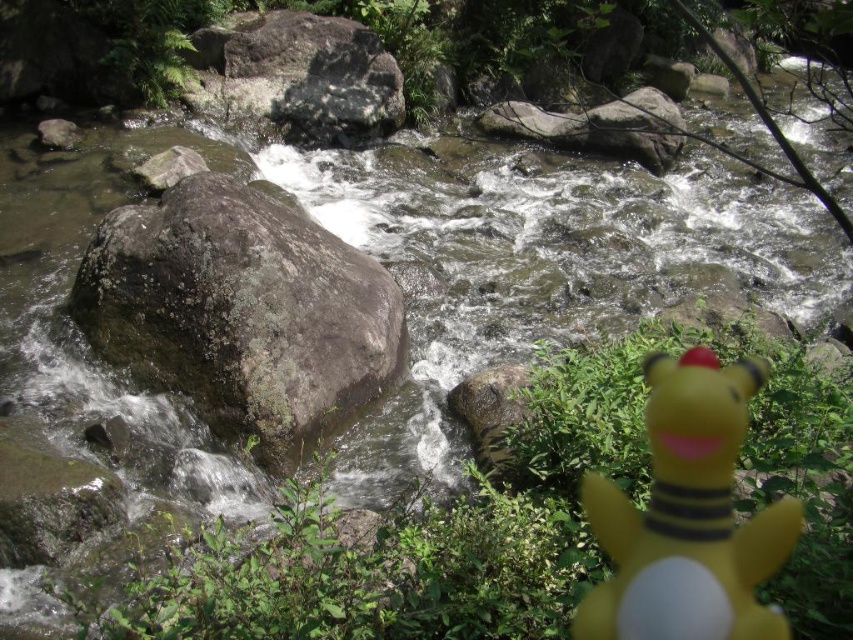
Question: Is yellow rubber duck at lower right bigger than gray rough rock at upper center?

Choices:
 (A) yes
 (B) no

Answer: (B)

Question: Which of these objects is positioned farthest from the green mossy rock at center-left?

Choices:
 (A) gray rough rock at upper center
 (B) yellow rubber duck at lower right

Answer: (A)

Question: Can you confirm if green mossy rock at center-left is positioned to the right of gray rough rock at upper center?

Choices:
 (A) no
 (B) yes

Answer: (B)

Question: Which of the following is the closest to the observer?

Choices:
 (A) (99, 257)
 (B) (635, 598)
 (C) (340, 93)

Answer: (B)

Question: Is green mossy rock at center-left further to the viewer compared to yellow rubber duck at lower right?

Choices:
 (A) no
 (B) yes

Answer: (B)

Question: Which of these objects is positioned farthest from the green mossy rock at center-left?

Choices:
 (A) gray rough rock at upper center
 (B) yellow rubber duck at lower right

Answer: (A)